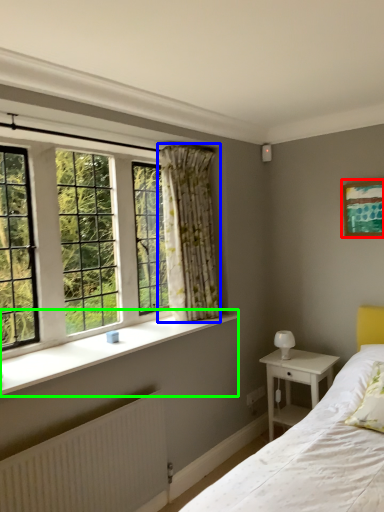
Question: Which is farther away from picture frame (highlighted by a red box)? curtain (highlighted by a blue box) or window sill (highlighted by a green box)?

Choices:
 (A) curtain
 (B) window sill

Answer: (B)